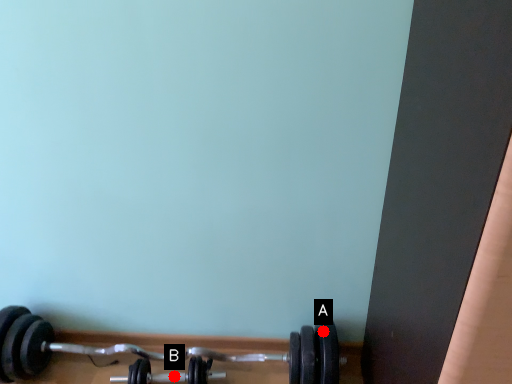
Question: Two points are circled on the image, labeled by A and B beside each circle. Among these points, which one is nearest to the camera?

Choices:
 (A) A is closer
 (B) B is closer

Answer: (A)